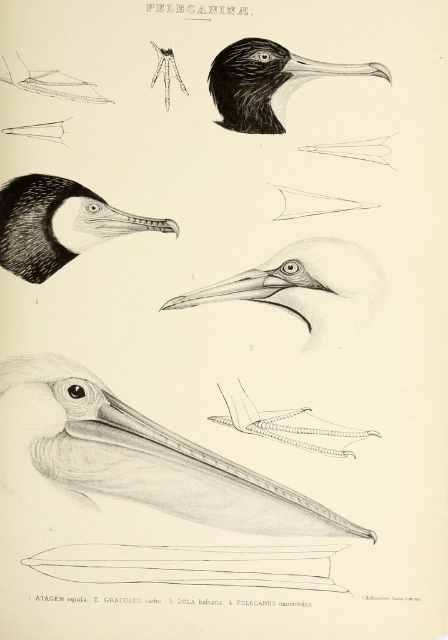
Based on the illustration labeled Graculius carbo, which object is taller when comparing the white matte beak at center and the black glossy pelican head at upper center?

The white matte beak at center is taller than the black glossy pelican head at upper center according to the illustration labeled Graculius carbo.

Based on the scene description, where is the black matte bird head at upper left located in the image?

The black matte bird head at upper left is located at the coordinates point (54, 224).

You are an ornithologist examining the illustration. You notice the black matte bird head at upper left and the matte gray beak at center. Which object is closer to the viewer?

The black matte bird head at upper left is closer to the viewer as it is positioned in front of the matte gray beak at center.